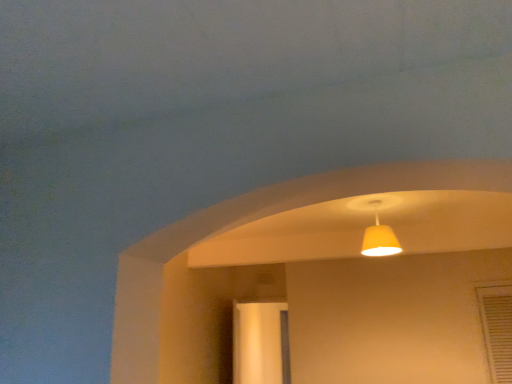
Question: Considering the positions of matte yellow lampshade at upper center and clear glass screen door at center in the image, is matte yellow lampshade at upper center taller or shorter than clear glass screen door at center?

Choices:
 (A) short
 (B) tall

Answer: (A)

Question: Considering their positions, is matte yellow lampshade at upper center located in front of or behind clear glass screen door at center?

Choices:
 (A) front
 (B) behind

Answer: (A)

Question: From the image's perspective, relative to clear glass screen door at center, is matte yellow lampshade at upper center above or below?

Choices:
 (A) above
 (B) below

Answer: (A)

Question: Is point (274, 382) positioned closer to the camera than point (364, 248)?

Choices:
 (A) closer
 (B) farther

Answer: (B)

Question: From a real-world perspective, is clear glass screen door at center above or below matte yellow lampshade at upper center?

Choices:
 (A) above
 (B) below

Answer: (B)

Question: Considering the positions of clear glass screen door at center and matte yellow lampshade at upper center in the image, is clear glass screen door at center taller or shorter than matte yellow lampshade at upper center?

Choices:
 (A) short
 (B) tall

Answer: (B)

Question: Is clear glass screen door at center in front of or behind matte yellow lampshade at upper center in the image?

Choices:
 (A) behind
 (B) front

Answer: (A)